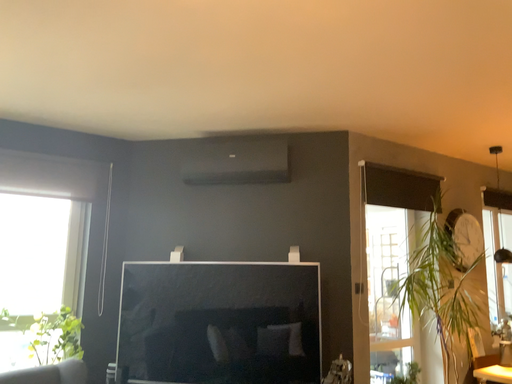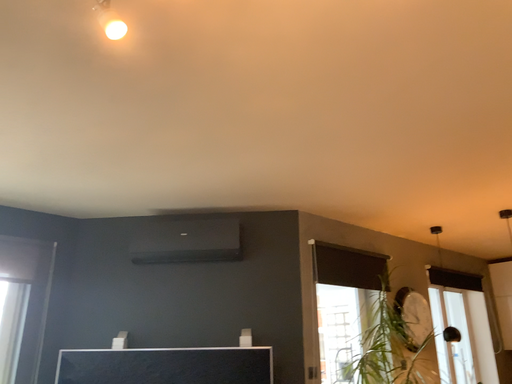
Question: Which way did the camera rotate in the video?

Choices:
 (A) rotated downward
 (B) rotated upward

Answer: (B)